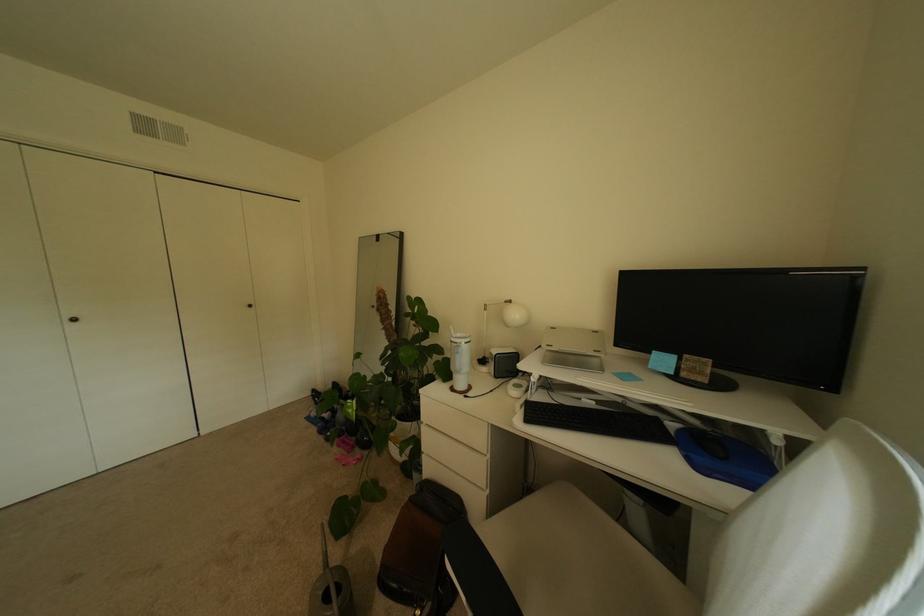
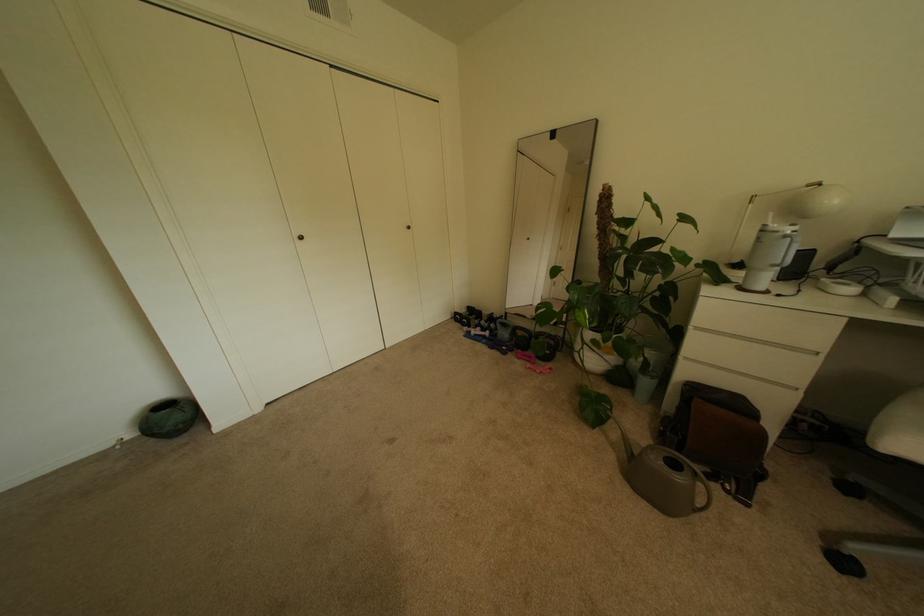
The point at (355, 435) is marked in the first image. Where is the corresponding point in the second image?

(524, 350)